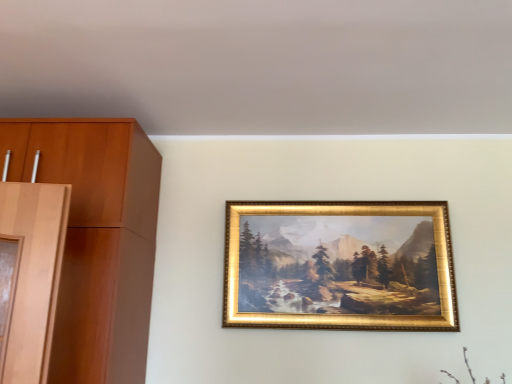
Question: Should I look upward or downward to see gold metallic frame at center?

Choices:
 (A) up
 (B) down

Answer: (B)

Question: Would you say gold metallic frame at center is a long distance from wooden cabinet at left?

Choices:
 (A) no
 (B) yes

Answer: (A)

Question: Is gold metallic frame at center bigger than wooden cabinet at left?

Choices:
 (A) yes
 (B) no

Answer: (B)

Question: Can we say gold metallic frame at center lies outside wooden cabinet at left?

Choices:
 (A) no
 (B) yes

Answer: (B)

Question: Does gold metallic frame at center have a greater height compared to wooden cabinet at left?

Choices:
 (A) yes
 (B) no

Answer: (B)

Question: From a real-world perspective, does gold metallic frame at center stand above wooden cabinet at left?

Choices:
 (A) yes
 (B) no

Answer: (B)

Question: Considering the relative sizes of gold metallic frame at center and wooden cabinet at left in the image provided, is gold metallic frame at center wider than wooden cabinet at left?

Choices:
 (A) no
 (B) yes

Answer: (A)

Question: Is wooden cabinet at left turned away from gold metallic frame at center?

Choices:
 (A) no
 (B) yes

Answer: (A)

Question: Is wooden cabinet at left not inside gold metallic frame at center?

Choices:
 (A) no
 (B) yes

Answer: (B)

Question: Is wooden cabinet at left not near gold metallic frame at center?

Choices:
 (A) yes
 (B) no

Answer: (B)

Question: From a real-world perspective, is wooden cabinet at left below gold metallic frame at center?

Choices:
 (A) no
 (B) yes

Answer: (A)

Question: From the image's perspective, is wooden cabinet at left under gold metallic frame at center?

Choices:
 (A) yes
 (B) no

Answer: (B)

Question: Considering the relative sizes of wooden cabinet at left and gold metallic frame at center in the image provided, is wooden cabinet at left wider than gold metallic frame at center?

Choices:
 (A) no
 (B) yes

Answer: (B)

Question: In terms of height, does gold metallic frame at center look taller or shorter compared to wooden cabinet at left?

Choices:
 (A) tall
 (B) short

Answer: (B)